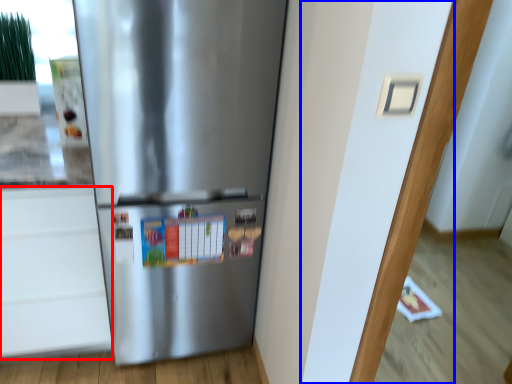
Question: Which object appears farthest to the camera in this image, drawer (highlighted by a red box) or door (highlighted by a blue box)?

Choices:
 (A) drawer
 (B) door

Answer: (A)